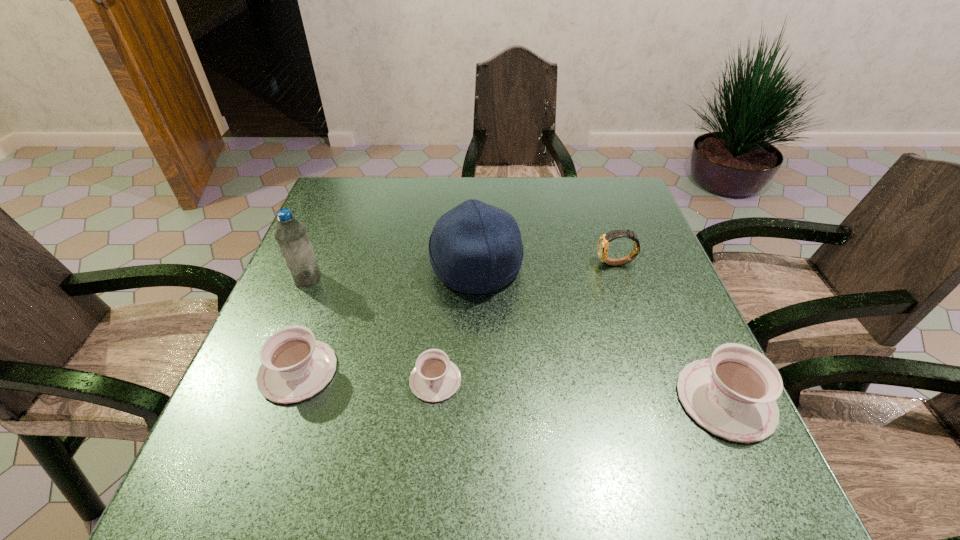
Where is `teacup located in the left edge section of the desktop`? The width and height of the screenshot is (960, 540). teacup located in the left edge section of the desktop is located at coordinates (295, 366).

You are a GUI agent. You are given a task and a screenshot of the screen. Output one action in this format:
    pyautogui.click(x=<x>, y=<y>)
    Task: Click on the water bottle that is at the left edge
    
    Given the screenshot: What is the action you would take?
    (x=291, y=235)

At what (x,y) coordinates should I click in order to perform the action: click on teacup at the right edge. Please return your answer as a coordinate pair (x, y). Looking at the image, I should click on (733, 395).

Find the location of a particular element. Image resolution: width=960 pixels, height=540 pixels. watch situated at the right edge is located at coordinates (603, 243).

Image resolution: width=960 pixels, height=540 pixels. In order to click on object positioned at the near left corner in this screenshot , I will do `click(295, 366)`.

Identify the location of object that is at the near right corner. This screenshot has height=540, width=960. (733, 395).

The width and height of the screenshot is (960, 540). What are the coordinates of `vacant space at the far edge` in the screenshot? It's located at (525, 178).

The width and height of the screenshot is (960, 540). What are the coordinates of `free space at the near edge of the desktop` in the screenshot? It's located at (372, 431).

Where is `vacant space at the left edge of the desktop`? vacant space at the left edge of the desktop is located at coordinates (341, 312).

Locate an element on the screen. free space at the right edge of the desktop is located at coordinates (669, 322).